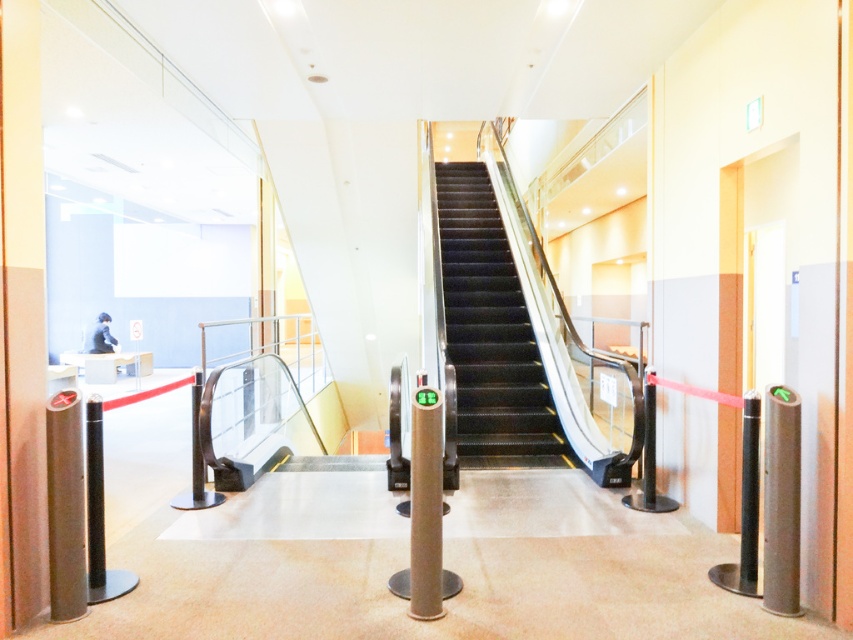
You are a maintenance worker needing to replace the smaller post between the metallic gray post at left and the metallic silver post at right. Which post should you replace?

The metallic silver post at right is smaller in size than the metallic gray post at left, so you should replace the metallic silver post at right.

You are standing at the entrance of the mall and see the black glossy escalator at center and the metallic silver post at right. Which object is closer to the left side of the entrance?

The black glossy escalator at center is closer to the left side of the entrance because it is positioned to the left of the metallic silver post at right.

You are standing at the entrance of the escalator system and want to reach a point closer to the camera. Which of the two points, point (775, 388) or point (410, 445), should you head towards?

You should head towards point (775, 388) because it is closer to the camera than point (410, 445).